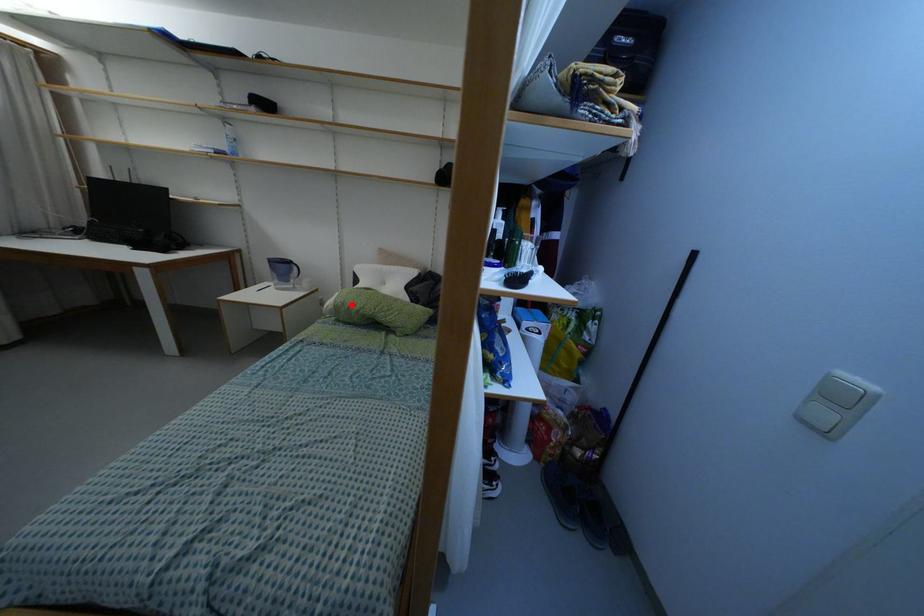
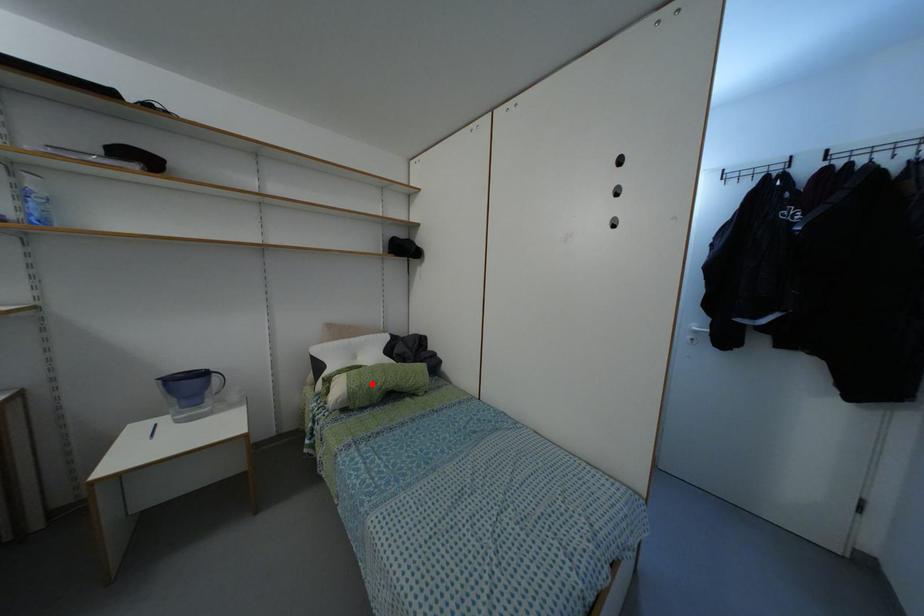
Looking at this image, I am providing you with two images of the same scene from different viewpoints. A red point is marked on the first image and another point is marked on the second image. Are the points marked in image1 and image2 representing the same 3D position?

Yes